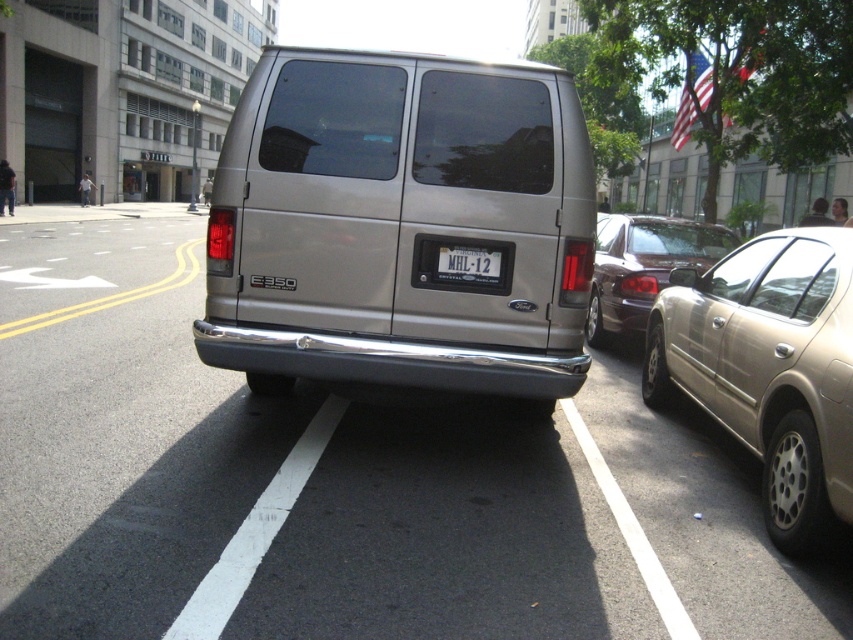
Does gold metallic sedan at right have a lesser height compared to white plastic license plate at center?

Incorrect, gold metallic sedan at right's height does not fall short of white plastic license plate at center's.

Consider the image. Does gold metallic sedan at right have a lesser width compared to white plastic license plate at center?

No, gold metallic sedan at right is not thinner than white plastic license plate at center.

In order to click on gold metallic sedan at right in this screenshot , I will do `click(769, 368)`.

At what (x,y) coordinates should I click in order to perform the action: click on gold metallic sedan at right. Please return your answer as a coordinate pair (x, y). The height and width of the screenshot is (640, 853). Looking at the image, I should click on (769, 368).

Between satin silver van at center and shiny dark brown sedan at center-right, which one appears on the right side from the viewer's perspective?

From the viewer's perspective, shiny dark brown sedan at center-right appears more on the right side.

In the scene shown: Does satin silver van at center have a lesser height compared to shiny dark brown sedan at center-right?

Indeed, satin silver van at center has a lesser height compared to shiny dark brown sedan at center-right.

Is point (329, 236) in front of point (674, 227)?

Yes.

Where is `satin silver van at center`? satin silver van at center is located at coordinates (399, 225).

Is satin silver van at center below white plastic license plate at center?

No.

Is satin silver van at center to the left of white plastic license plate at center from the viewer's perspective?

Yes, satin silver van at center is to the left of white plastic license plate at center.

Describe the element at coordinates (399, 225) in the screenshot. I see `satin silver van at center` at that location.

The width and height of the screenshot is (853, 640). What are the coordinates of `satin silver van at center` in the screenshot? It's located at (399, 225).